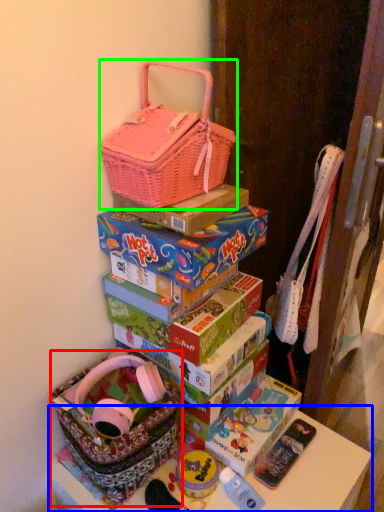
Question: Considering the real-world distances, which object is farthest from gift basket (highlighted by a red box)? table (highlighted by a blue box) or handbag (highlighted by a green box)?

Choices:
 (A) table
 (B) handbag

Answer: (B)